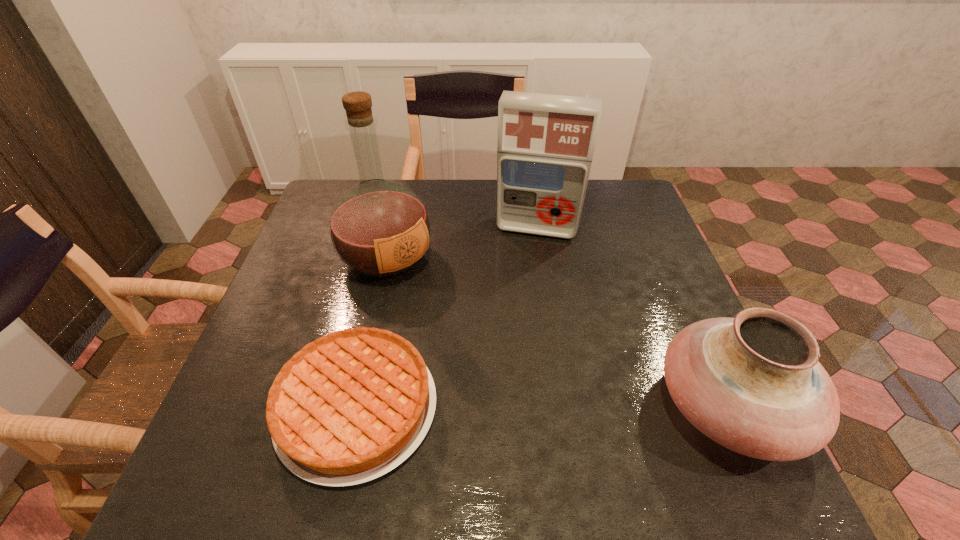
Identify the location of object positioned at the near left corner. (349, 407).

Where is `object located at the near right corner`? The image size is (960, 540). object located at the near right corner is located at coordinates (753, 383).

In the image, there is a desktop. Where is `free space at the far edge`? free space at the far edge is located at coordinates (442, 198).

Identify the location of vacant region at the near edge of the desktop. (552, 400).

The height and width of the screenshot is (540, 960). Identify the location of vacant space at the left edge of the desktop. (297, 298).

Where is `vacant space at the right edge`? vacant space at the right edge is located at coordinates (635, 256).

The height and width of the screenshot is (540, 960). Identify the location of free space at the far left corner of the desktop. (343, 191).

Locate an element on the screen. The width and height of the screenshot is (960, 540). vacant space at the far right corner of the desktop is located at coordinates (640, 214).

Locate an element on the screen. This screenshot has height=540, width=960. vacant space at the near right corner of the desktop is located at coordinates (664, 398).

The height and width of the screenshot is (540, 960). What are the coordinates of `vacant area that lies between the first-aid kit and the pie` in the screenshot? It's located at (447, 318).